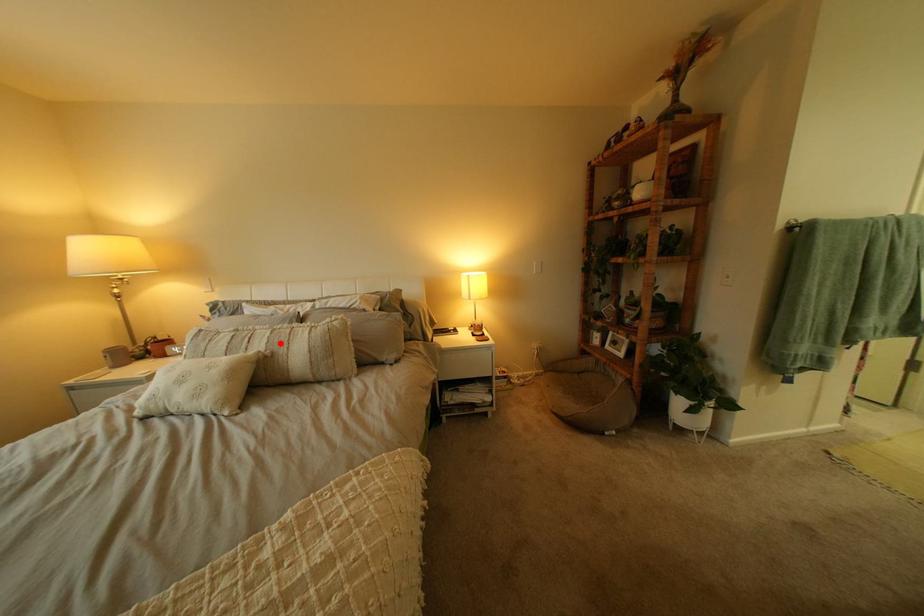
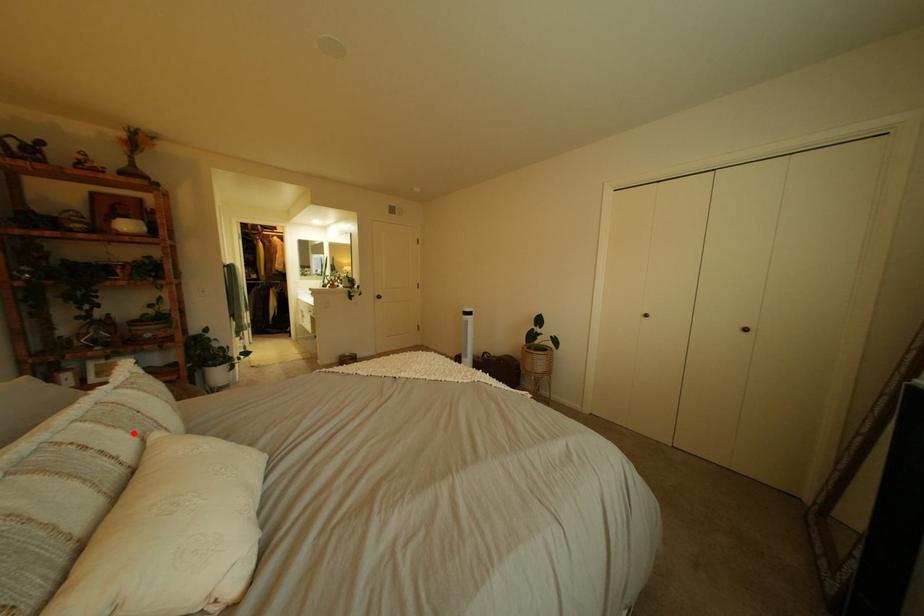
I am providing you with two images of the same scene from different viewpoints. A red point is marked on the first image and another point is marked on the second image. Are the points marked in image1 and image2 representing the same 3D position?

Yes